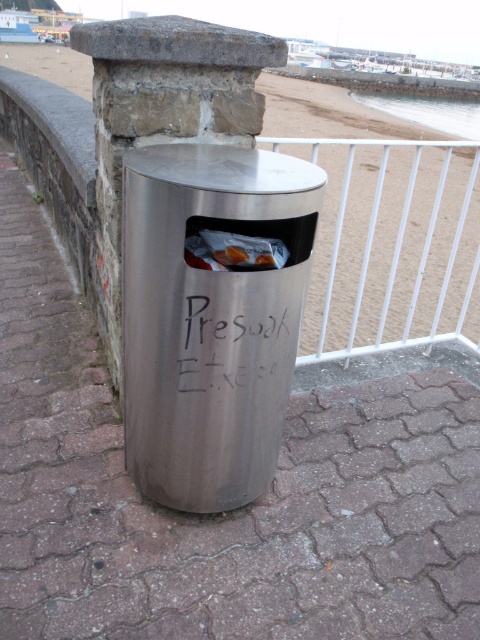
Is stainless steel trash can at center positioned before translucent plastic bag at center?

Yes, stainless steel trash can at center is in front of translucent plastic bag at center.

Is point (189, 337) closer to camera compared to point (195, 241)?

No, (189, 337) is behind (195, 241).

At what (x,y) coordinates should I click in order to perform the action: click on stainless steel trash can at center. Please return your answer as a coordinate pair (x, y). The height and width of the screenshot is (640, 480). Looking at the image, I should click on (212, 316).

Can you confirm if silver metallic trash can at center is bigger than translucent plastic bag at center?

Correct, silver metallic trash can at center is larger in size than translucent plastic bag at center.

Does point (83, 81) lie in front of point (199, 237)?

No, (83, 81) is behind (199, 237).

The height and width of the screenshot is (640, 480). I want to click on silver metallic trash can at center, so click(x=393, y=244).

Who is more forward, (298, 304) or (204, 256)?

Positioned in front is point (204, 256).

Is black matte graffiti at center bigger than translucent plastic bag at center?

Yes, black matte graffiti at center is bigger than translucent plastic bag at center.

Describe the element at coordinates (237, 342) in the screenshot. The image size is (480, 640). I see `black matte graffiti at center` at that location.

At what (x,y) coordinates should I click in order to perform the action: click on black matte graffiti at center. Please return your answer as a coordinate pair (x, y). The image size is (480, 640). Looking at the image, I should click on (237, 342).